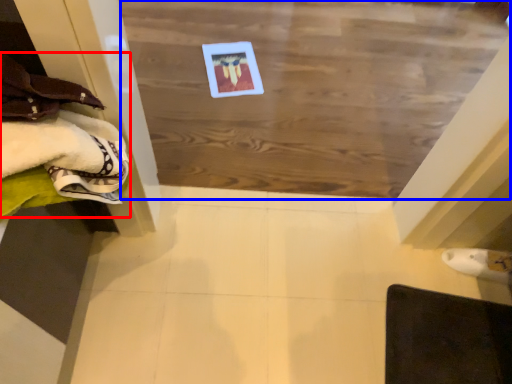
Question: Which object appears closest to the camera in this image, clothing (highlighted by a red box) or plywood (highlighted by a blue box)?

Choices:
 (A) clothing
 (B) plywood

Answer: (A)